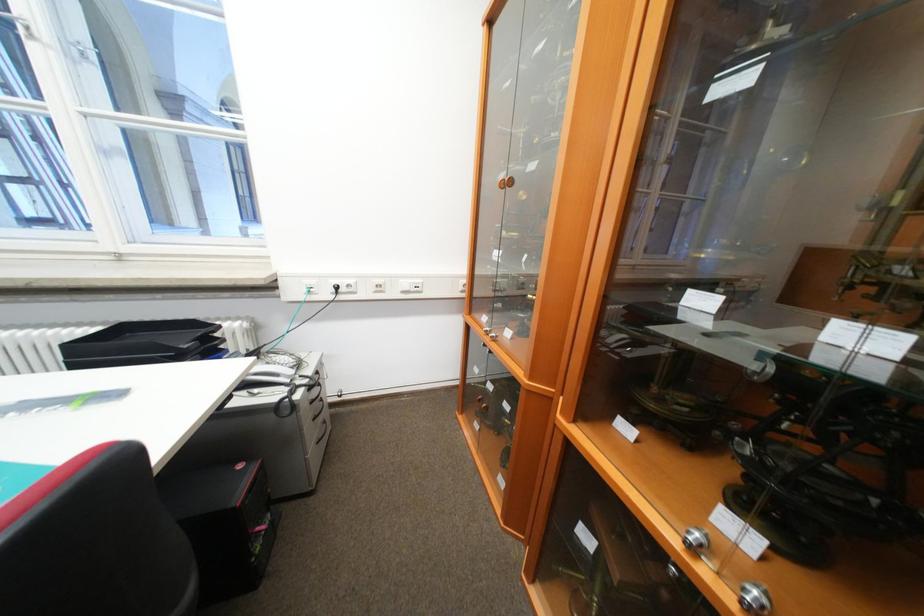
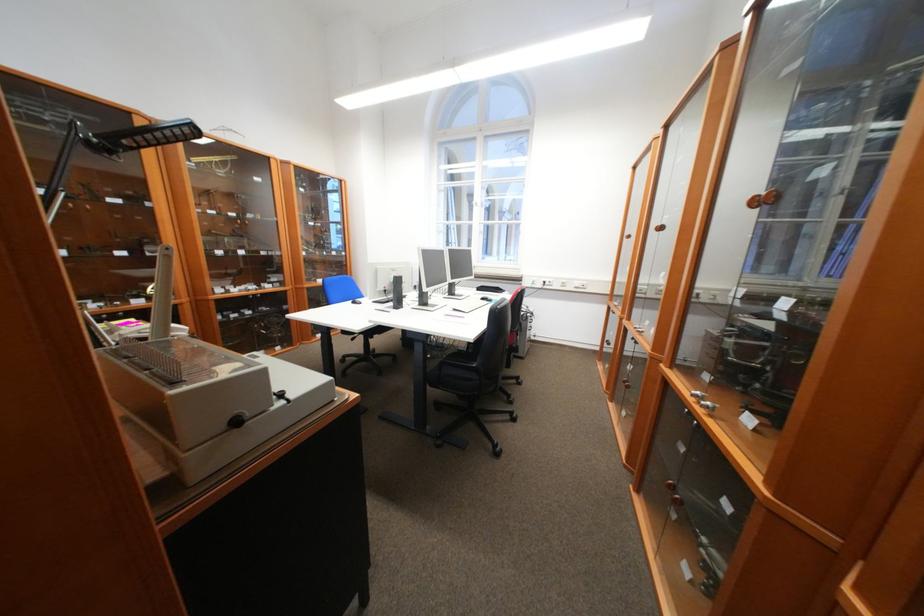
Find the pixel in the second image that matches the point at 365,294 in the first image.

(562, 286)